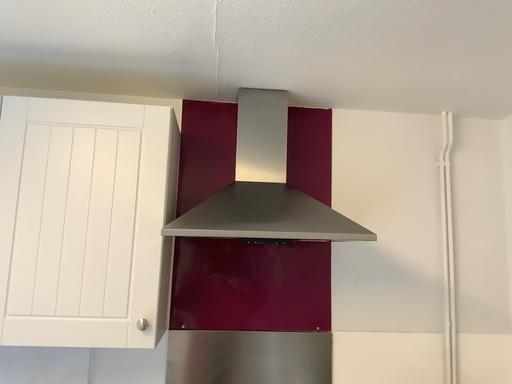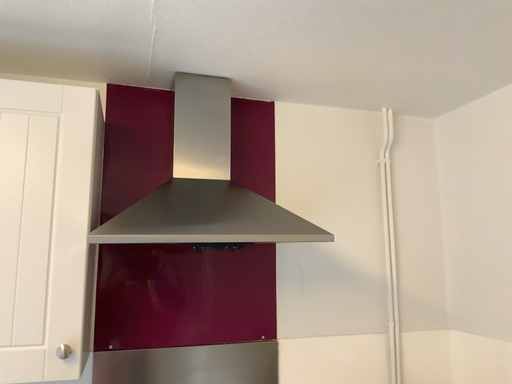
Question: How did the camera likely rotate when shooting the video?

Choices:
 (A) rotated left
 (B) rotated right

Answer: (B)